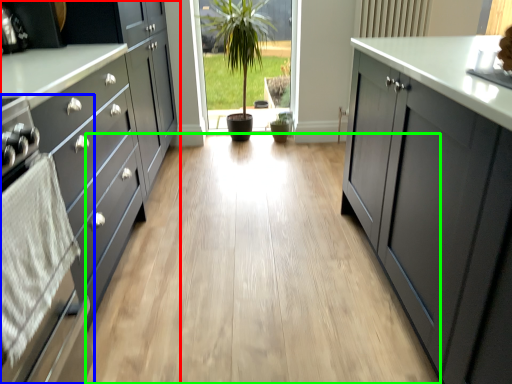
Question: Estimate the real-world distances between objects in this image. Which object is closer to cabinetry (highlighted by a red box), oven (highlighted by a blue box) or plain (highlighted by a green box)?

Choices:
 (A) oven
 (B) plain

Answer: (A)